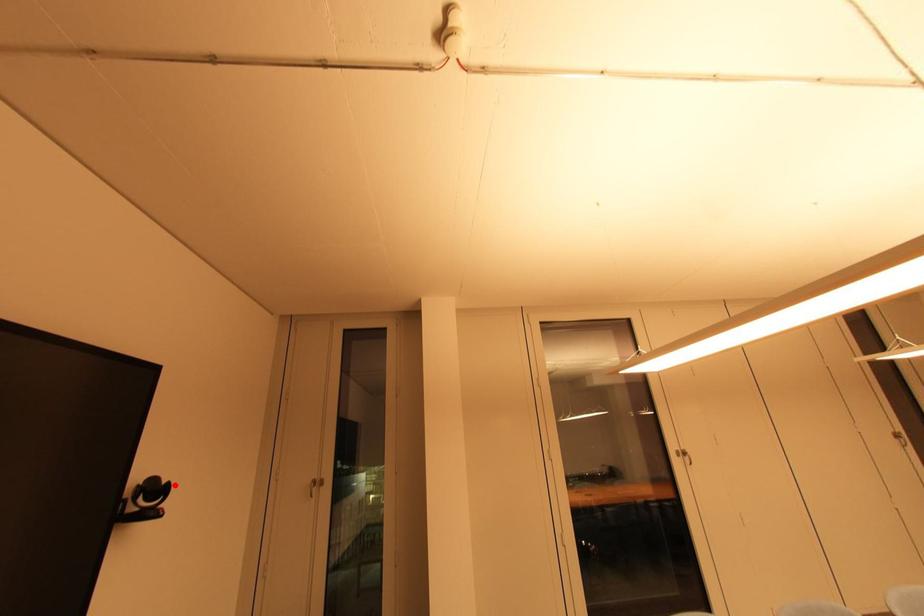
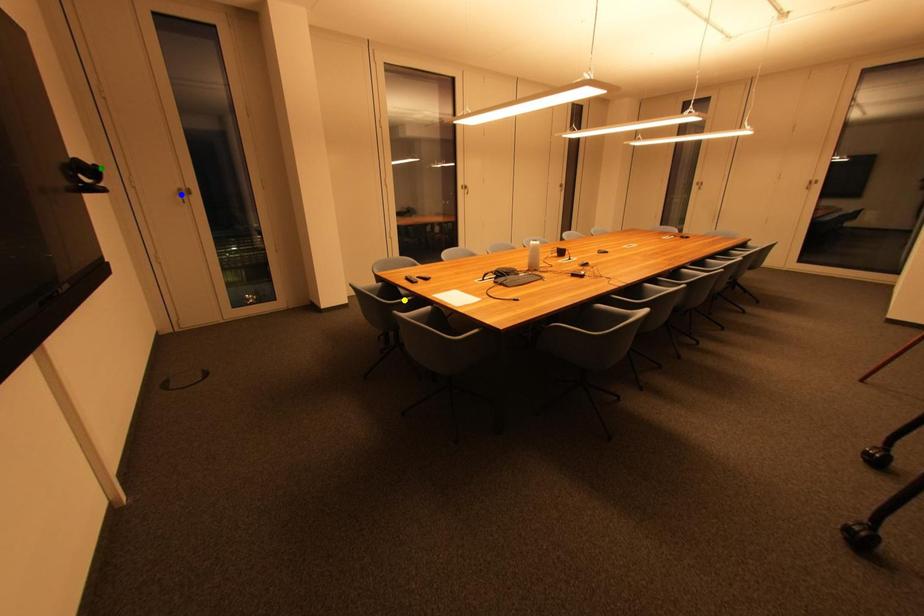
Question: I am providing you with two images of the same scene from different viewpoints. A red point is marked on the first image. You are given multiple points on the second image. Which point in image 2 is actually the same real-world point as the red point in image 1?

Choices:
 (A) blue point
 (B) yellow point
 (C) green point

Answer: (C)